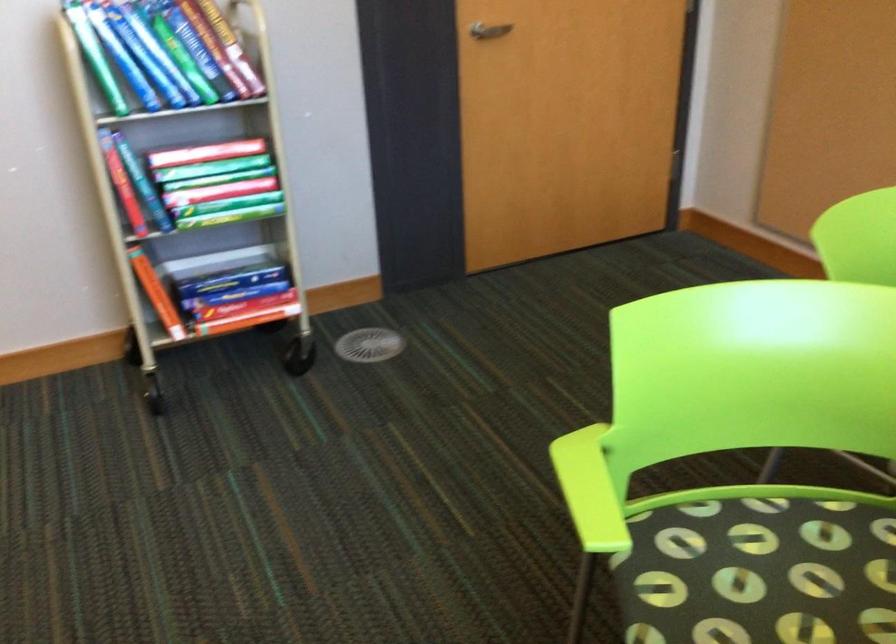
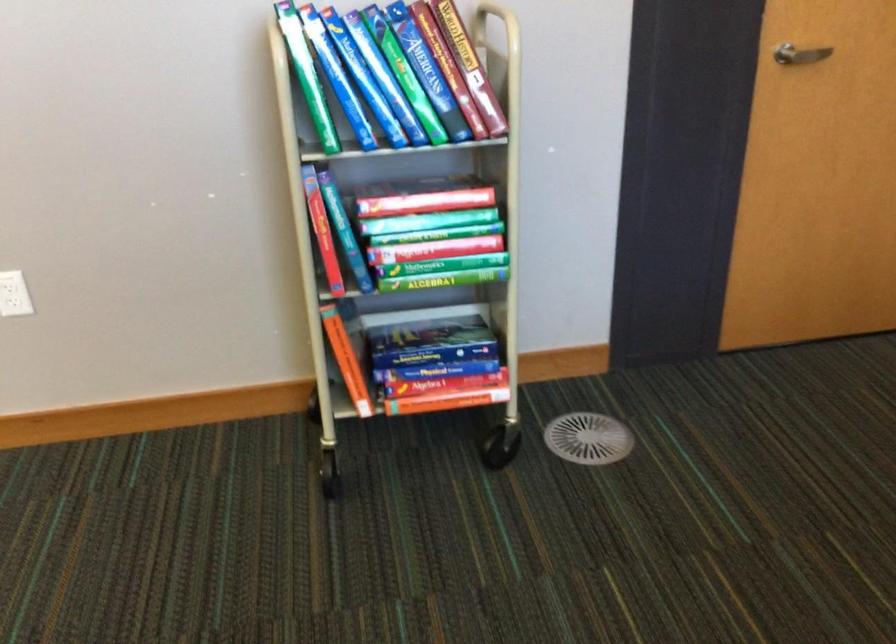
Question: What movement of the cameraman would produce the second image?

Choices:
 (A) Left
 (B) Right
 (C) Forward
 (D) Backward

Answer: (C)